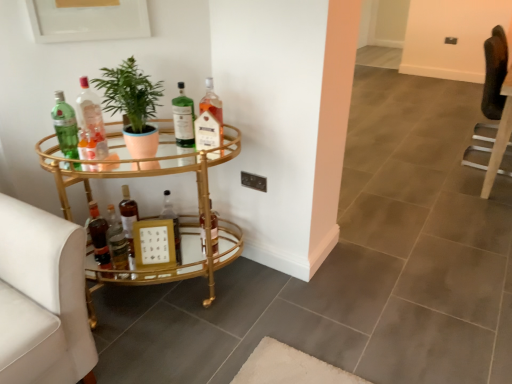
Question: In terms of size, does gold metallic swivel chair at left, which appears as the second swivel chair when viewed from the top, appear bigger or smaller than translucent glass bottle at center, the tenth bottle positioned from the left?

Choices:
 (A) small
 (B) big

Answer: (B)

Question: From a real-world perspective, is gold metallic swivel chair at left, placed as the 2th swivel chair when sorted from back to front, above or below translucent glass bottle at center, the 1th bottle viewed from the right?

Choices:
 (A) below
 (B) above

Answer: (A)

Question: Which of these objects is positioned farthest from the translucent glass bottle at center, the 2th bottle when ordered from right to left?

Choices:
 (A) leather swivel chair at right, the second swivel chair ordered from the bottom
 (B) translucent glass bottle at center, the 1th bottle viewed from the right
 (C) translucent glass bottle at center, which ranks as the 4th bottle in left-to-right order
 (D) matte brown bottle at lower left, the 5th bottle when ordered from right to left
 (E) green matte plant at center

Answer: (A)

Question: Which of these objects is positioned farthest from the shiny brown bottle at lower left, the second bottle when ordered from left to right?

Choices:
 (A) gold mirrored bar cart at left
 (B) shiny gold bottle at lower left, the sixth bottle from the right
 (C) green glass bottle at upper left, which ranks as the 1th bottle in left-to-right order
 (D) green matte plant at center
 (E) matte brown bottle at lower left, the 6th bottle viewed from the left

Answer: (D)